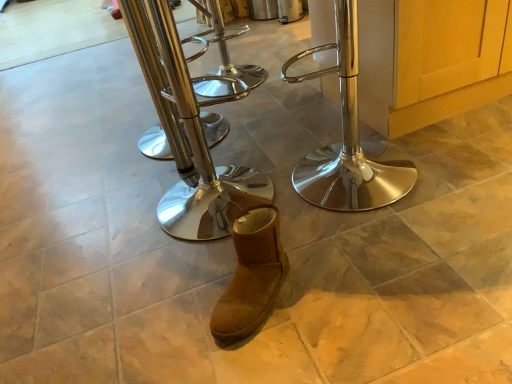
Question: From the image's perspective, is brown suede boot at center located above polished chrome stool at center, the second step stool viewed from the right?

Choices:
 (A) no
 (B) yes

Answer: (A)

Question: Is brown suede boot at center with polished chrome stool at center, the second step stool when ordered from left to right?

Choices:
 (A) no
 (B) yes

Answer: (A)

Question: Can we say brown suede boot at center lies outside polished chrome stool at center, the second step stool viewed from the right?

Choices:
 (A) no
 (B) yes

Answer: (B)

Question: From the image's perspective, is brown suede boot at center located beneath polished chrome stool at center, the second step stool when ordered from left to right?

Choices:
 (A) no
 (B) yes

Answer: (B)

Question: Considering the relative positions of brown suede boot at center and polished chrome stool at center, the second step stool when ordered from left to right, in the image provided, is brown suede boot at center behind polished chrome stool at center, the second step stool when ordered from left to right,?

Choices:
 (A) no
 (B) yes

Answer: (B)

Question: Is polished metal bar stool at center, which is the 1th step stool from left to right, bigger or smaller than brown suede boot at center?

Choices:
 (A) small
 (B) big

Answer: (B)

Question: In the image, is polished metal bar stool at center, the third step stool viewed from the right, positioned in front of or behind brown suede boot at center?

Choices:
 (A) behind
 (B) front

Answer: (A)

Question: From their relative heights in the image, would you say polished metal bar stool at center, which is the 1th step stool from left to right, is taller or shorter than brown suede boot at center?

Choices:
 (A) short
 (B) tall

Answer: (B)

Question: Looking at their shapes, would you say polished metal bar stool at center, which is the 1th step stool from left to right, is wider or thinner than brown suede boot at center?

Choices:
 (A) wide
 (B) thin

Answer: (A)

Question: Choose the correct answer: Is brown suede boot at center inside polished metal bar stool at center, which is the 1th step stool from left to right, or outside it?

Choices:
 (A) outside
 (B) inside

Answer: (A)

Question: Does point (269, 296) appear closer or farther from the camera than point (214, 125)?

Choices:
 (A) farther
 (B) closer

Answer: (B)

Question: Considering the positions of brown suede boot at center and polished metal bar stool at center, the third step stool viewed from the right, in the image, is brown suede boot at center taller or shorter than polished metal bar stool at center, the third step stool viewed from the right,?

Choices:
 (A) short
 (B) tall

Answer: (A)

Question: Looking at their shapes, would you say brown suede boot at center is wider or thinner than polished metal bar stool at center, the third step stool viewed from the right?

Choices:
 (A) thin
 (B) wide

Answer: (A)

Question: Is polished chrome stool at center, which ranks as the 3th step stool in left-to-right order, to the left or to the right of polished chrome stool at center, the second step stool when ordered from left to right, in the image?

Choices:
 (A) right
 (B) left

Answer: (A)

Question: In the image, is polished chrome stool at center, which ranks as the 3th step stool in left-to-right order, positioned in front of or behind polished chrome stool at center, the second step stool viewed from the right?

Choices:
 (A) front
 (B) behind

Answer: (B)